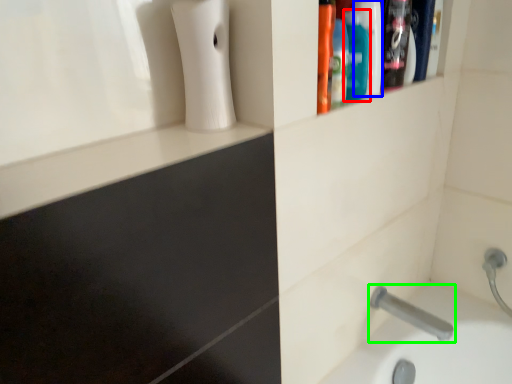
Question: Considering the real-world distances, which object is farthest from mouthwash (highlighted by a red box)? mouthwash (highlighted by a blue box) or tap (highlighted by a green box)?

Choices:
 (A) mouthwash
 (B) tap

Answer: (B)